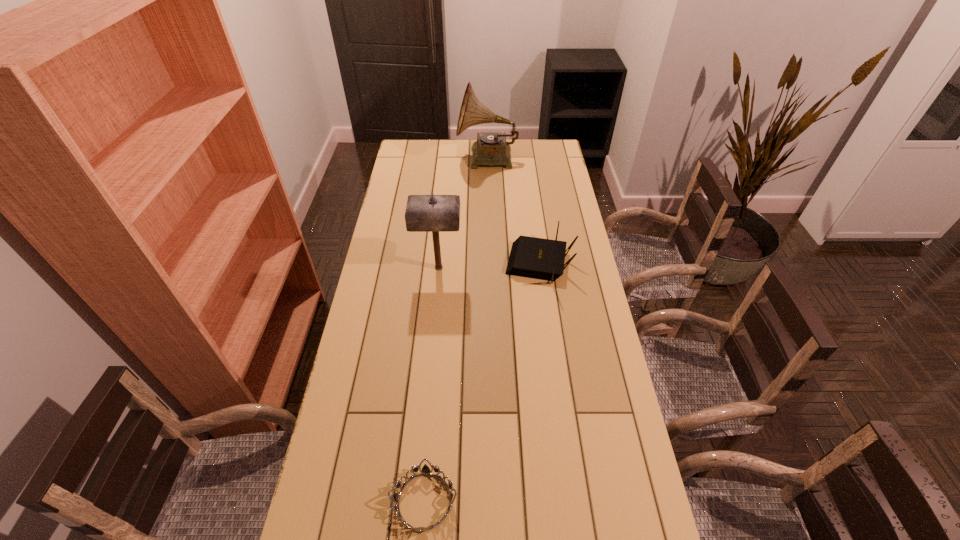
Locate an element on the screen. vacant point located between the tiara and the second shortest object is located at coordinates (482, 383).

Identify the location of vacant point located between the router and the mallet. (490, 266).

You are a GUI agent. You are given a task and a screenshot of the screen. Output one action in this format:
    pyautogui.click(x=<x>, y=<y>)
    Task: Click on the free space between the router and the tiara
    This screenshot has width=960, height=540.
    Given the screenshot: What is the action you would take?
    pyautogui.click(x=482, y=383)

Locate an element on the screen. The image size is (960, 540). free area in between the nearest object and the record player is located at coordinates (456, 330).

At what (x,y) coordinates should I click in order to perform the action: click on free area in between the mallet and the router. Please return your answer as a coordinate pair (x, y). The width and height of the screenshot is (960, 540). Looking at the image, I should click on (490, 266).

This screenshot has width=960, height=540. I want to click on empty space between the mallet and the record player, so click(x=463, y=213).

Locate an element on the screen. Image resolution: width=960 pixels, height=540 pixels. free space between the record player and the tiara is located at coordinates (456, 330).

This screenshot has height=540, width=960. Find the location of `free space that is in between the record player and the router`. free space that is in between the record player and the router is located at coordinates (514, 212).

The image size is (960, 540). What are the coordinates of `vacant space that is in between the nearest object and the mallet` in the screenshot? It's located at (431, 384).

Choose which object is the nearest neighbor to the mallet. Please provide its 2D coordinates. Your answer should be formatted as a tuple, i.e. [(x, y)], where the tuple contains the x and y coordinates of a point satisfying the conditions above.

[(530, 257)]